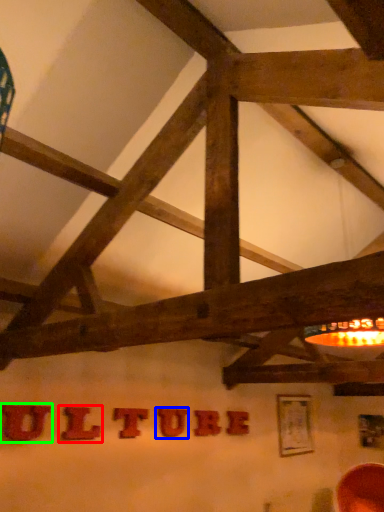
Question: Estimate the real-world distances between objects in this image. Which object is farther from letter (highlighted by a red box), letter (highlighted by a blue box) or letter (highlighted by a green box)?

Choices:
 (A) letter
 (B) letter

Answer: (A)